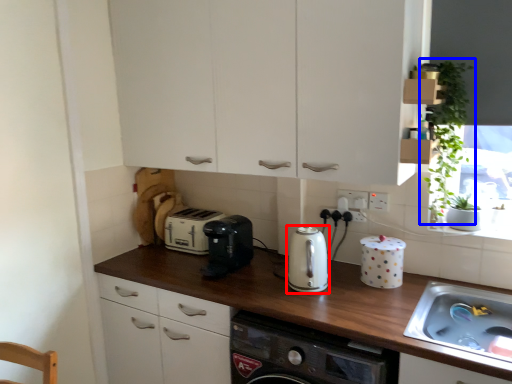
Question: Which of the following is the closest to the observer, kitchen appliance (highlighted by a red box) or plant (highlighted by a blue box)?

Choices:
 (A) kitchen appliance
 (B) plant

Answer: (B)